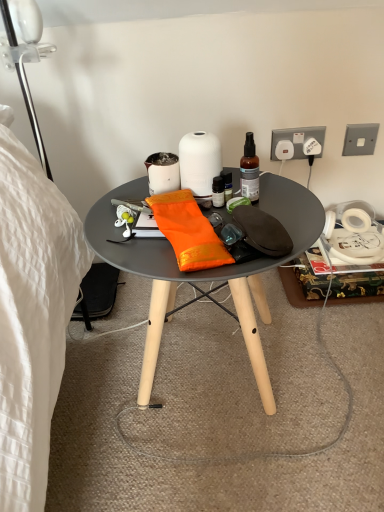
This screenshot has width=384, height=512. In order to click on vacant area situated to the left side of matte white coffee cup at center in this screenshot , I will do `click(121, 195)`.